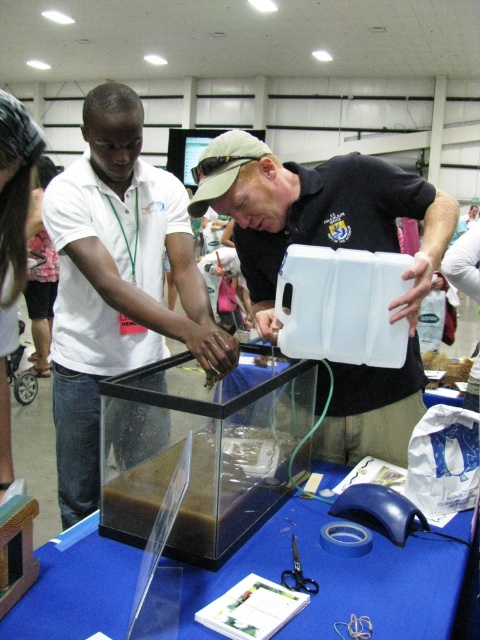
What do you see at coordinates (334, 248) in the screenshot?
I see `white matte container at center` at bounding box center [334, 248].

Who is more forward, (247, 282) or (72, 556)?

Point (72, 556)

Between point (396, 424) and point (459, 579), which one is positioned behind?

Positioned behind is point (396, 424).

Where is `white matte container at center`? The height and width of the screenshot is (640, 480). white matte container at center is located at coordinates (334, 248).

Does white shirt at center have a greater height compared to blue plastic table at center?

Yes, white shirt at center is taller than blue plastic table at center.

Can you confirm if white shirt at center is positioned above blue plastic table at center?

Yes, white shirt at center is above blue plastic table at center.

Between point (56, 180) and point (294, 516), which one is positioned in front?

Point (294, 516) is more forward.

Where is `white shirt at center`? Image resolution: width=480 pixels, height=640 pixels. white shirt at center is located at coordinates (117, 282).

In order to click on white shirt at center in this screenshot , I will do `click(117, 282)`.

Is point (153, 221) positioned after point (269, 243)?

Yes, point (153, 221) is behind point (269, 243).

Is point (133, 436) closer to viewer compared to point (444, 248)?

Yes, point (133, 436) is closer to viewer.

Locate an element on the screen. This screenshot has width=480, height=640. white shirt at center is located at coordinates (117, 282).